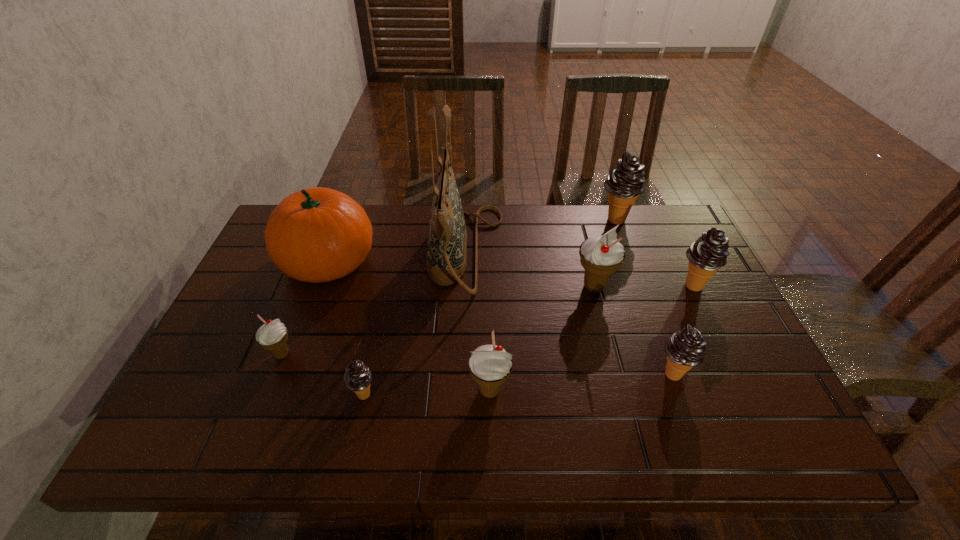
Locate which white icecream is the third closest to the second icecream from left to right. Please provide its 2D coordinates. Your answer should be formatted as a tuple, i.e. [(x, y)], where the tuple contains the x and y coordinates of a point satisfying the conditions above.

[(601, 255)]

Identify which white icecream is located as the second nearest to the tallest object. Please provide its 2D coordinates. Your answer should be formatted as a tuple, i.e. [(x, y)], where the tuple contains the x and y coordinates of a point satisfying the conditions above.

[(490, 366)]

Find the location of a particular element. free location that satisfies the following two spatial constraints: 1. on the back side of the nearest white icecream; 2. on the front-facing side of the tallest object is located at coordinates (488, 253).

This screenshot has width=960, height=540. Find the location of `free space in the image that satisfies the following two spatial constraints: 1. on the front-facing side of the tallest object; 2. on the left side of the second farthest chocolate icecream`. free space in the image that satisfies the following two spatial constraints: 1. on the front-facing side of the tallest object; 2. on the left side of the second farthest chocolate icecream is located at coordinates (465, 285).

Locate an element on the screen. This screenshot has width=960, height=540. free spot that satisfies the following two spatial constraints: 1. on the front side of the pumpkin; 2. on the right side of the farthest white icecream is located at coordinates (319, 287).